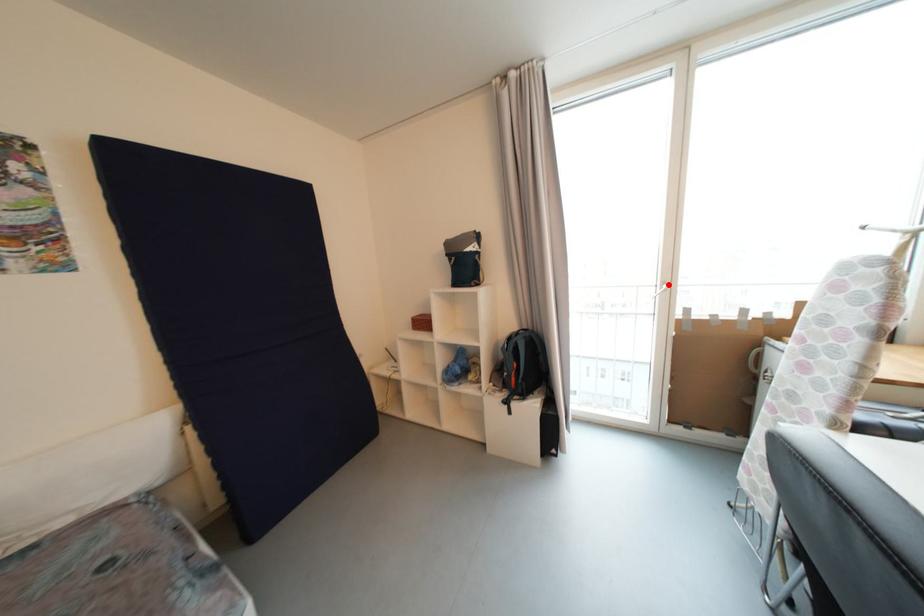
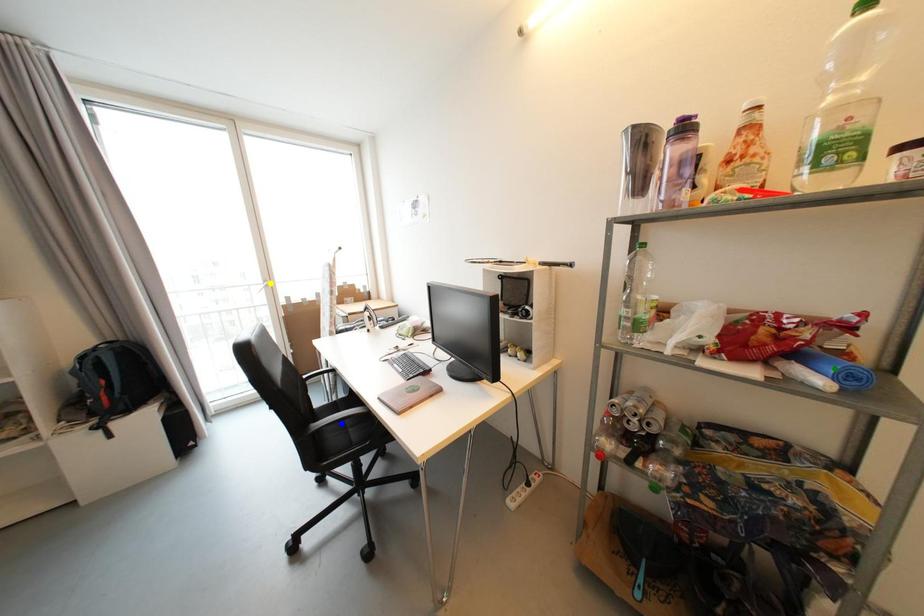
Question: I am providing you with two images of the same scene from different viewpoints. A red point is marked on the first image. You are given multiple points on the second image. Can you choose the point in image 2 that corresponds to the point in image 1?

Choices:
 (A) green point
 (B) yellow point
 (C) blue point

Answer: (B)